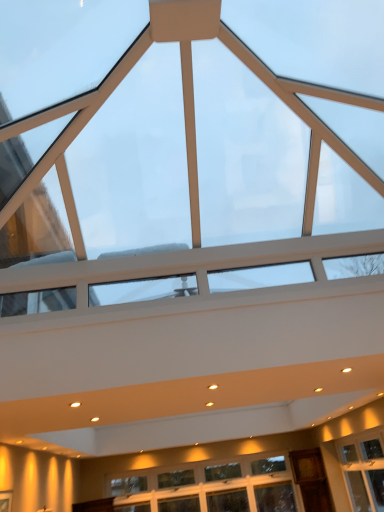
Question: From the image's perspective, is transparent glass window at center, placed as the 1th window when sorted from top to bottom, located above clear glass window at lower center, the 1th window when ordered from back to front?

Choices:
 (A) no
 (B) yes

Answer: (B)

Question: Considering the relative sizes of transparent glass window at center, acting as the second window starting from the bottom, and clear glass window at lower center, the 1th window when ordered from back to front, in the image provided, is transparent glass window at center, acting as the second window starting from the bottom, thinner than clear glass window at lower center, the 1th window when ordered from back to front,?

Choices:
 (A) yes
 (B) no

Answer: (B)

Question: Is transparent glass window at center, placed as the 1th window when sorted from top to bottom, located outside clear glass window at lower center, arranged as the 2th window when viewed from the front?

Choices:
 (A) no
 (B) yes

Answer: (B)

Question: Does transparent glass window at center, the 1th window viewed from the front, appear on the right side of clear glass window at lower center, the 2th window in the top-to-bottom sequence?

Choices:
 (A) no
 (B) yes

Answer: (A)

Question: Is transparent glass window at center, the 1th window viewed from the front, wider than clear glass window at lower center, marked as the first window in a bottom-to-top arrangement?

Choices:
 (A) no
 (B) yes

Answer: (B)

Question: Is clear glass window at lower center, marked as the first window in a bottom-to-top arrangement, completely or partially inside transparent glass window at center, which is the 2th window from back to front?

Choices:
 (A) no
 (B) yes

Answer: (A)

Question: From the image's perspective, is clear glass window at lower center, the 2th window in the top-to-bottom sequence, located beneath transparent glass window at center, which is the 2th window from back to front?

Choices:
 (A) yes
 (B) no

Answer: (A)

Question: Is clear glass window at lower center, marked as the first window in a bottom-to-top arrangement, far away from transparent glass window at center, the 1th window viewed from the front?

Choices:
 (A) no
 (B) yes

Answer: (B)

Question: Is clear glass window at lower center, arranged as the 2th window when viewed from the front, not within transparent glass window at center, placed as the 1th window when sorted from top to bottom?

Choices:
 (A) yes
 (B) no

Answer: (A)

Question: Considering the relative sizes of clear glass window at lower center, the 1th window when ordered from back to front, and transparent glass window at center, the 1th window viewed from the front, in the image provided, is clear glass window at lower center, the 1th window when ordered from back to front, shorter than transparent glass window at center, the 1th window viewed from the front,?

Choices:
 (A) no
 (B) yes

Answer: (B)

Question: Is clear glass window at lower center, marked as the first window in a bottom-to-top arrangement, closer to the viewer compared to transparent glass window at center, the 1th window viewed from the front?

Choices:
 (A) yes
 (B) no

Answer: (B)

Question: Considering the relative sizes of clear glass window at lower center, the 2th window in the top-to-bottom sequence, and transparent glass window at center, the 1th window viewed from the front, in the image provided, is clear glass window at lower center, the 2th window in the top-to-bottom sequence, thinner than transparent glass window at center, the 1th window viewed from the front,?

Choices:
 (A) no
 (B) yes

Answer: (B)

Question: From their relative heights in the image, would you say transparent glass window at center, acting as the second window starting from the bottom, is taller or shorter than clear glass window at lower center, the 1th window when ordered from back to front?

Choices:
 (A) short
 (B) tall

Answer: (B)